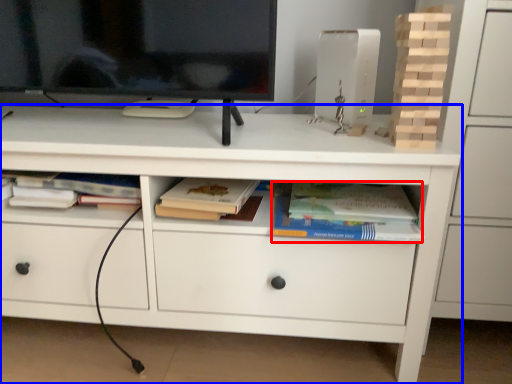
Question: Which of the following is the farthest to the observer, paperback book (highlighted by a red box) or chest of drawers (highlighted by a blue box)?

Choices:
 (A) paperback book
 (B) chest of drawers

Answer: (A)